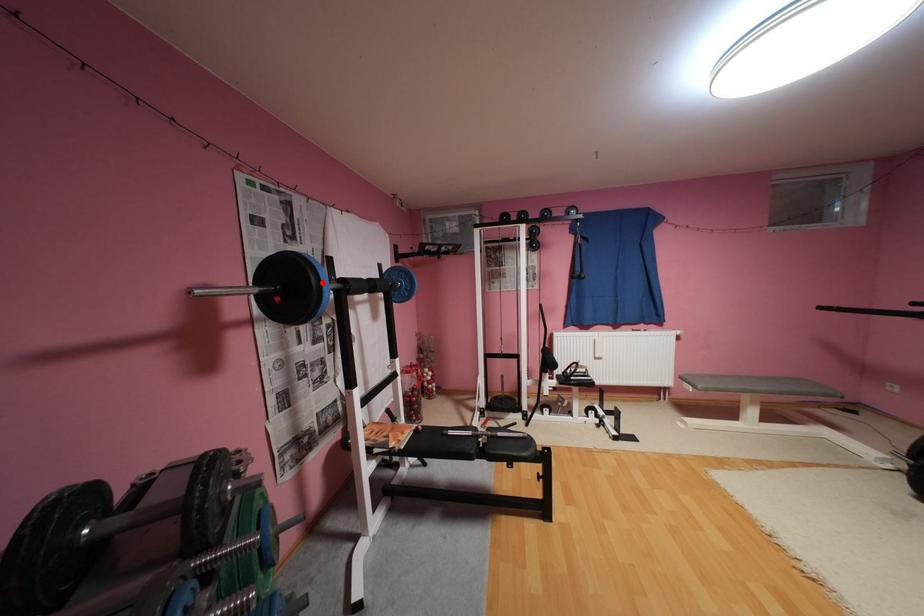
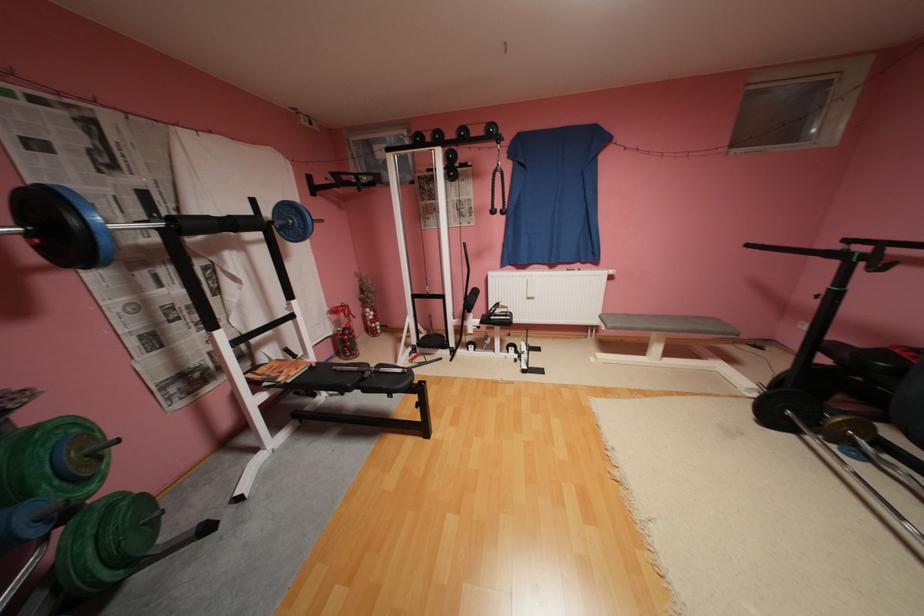
Where in the second image is the point corresponding to the highlighted location from the first image?

(82, 222)